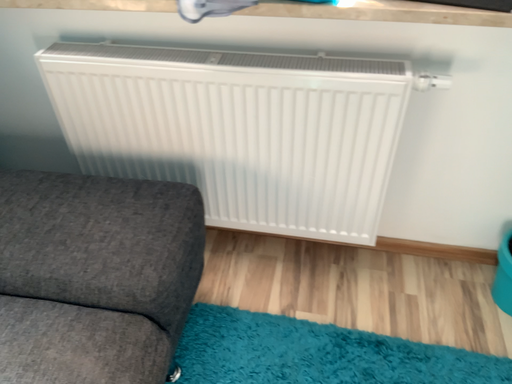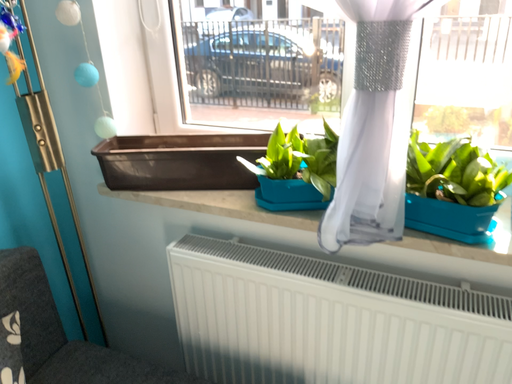
Question: Which way did the camera rotate in the video?

Choices:
 (A) rotated downward
 (B) rotated upward

Answer: (B)